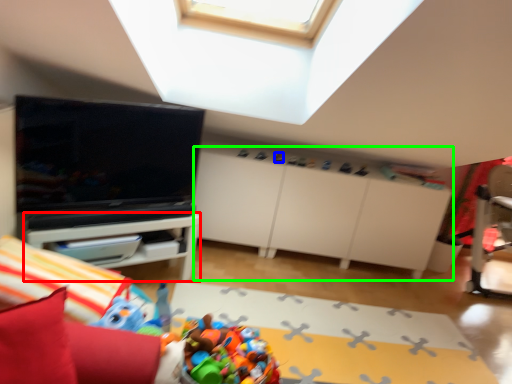
Question: Considering the real-world distances, which object is closest to table (highlighted by a red box)? toy (highlighted by a blue box) or dresser (highlighted by a green box).

Choices:
 (A) toy
 (B) dresser

Answer: (B)